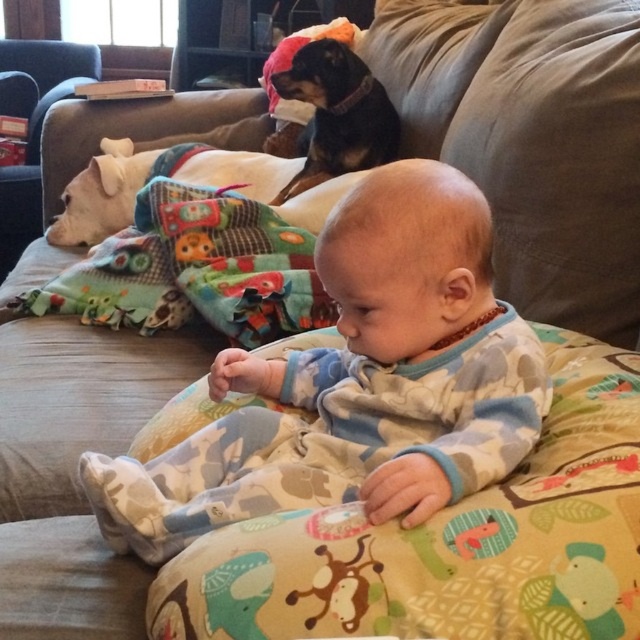
Measure the distance from printed fabric baby at center to white soft dog at left.

7.70 feet

Is printed fabric baby at center thinner than white soft dog at left?

No.

Who is more forward, (321,608) or (19,250)?

Point (321,608)

Locate an element on the screen. printed fabric baby at center is located at coordinates (449, 541).

Does printed fabric baby at center appear over black smooth dog at upper center?

Actually, printed fabric baby at center is below black smooth dog at upper center.

Which is above, printed fabric baby at center or black smooth dog at upper center?

black smooth dog at upper center

Does point (458, 609) lie in front of point (314, 184)?

Yes, it is.

Identify the location of printed fabric baby at center. (449, 541).

Who is lower down, fluffy blue and white pajamas at center or black smooth dog at upper center?

Positioned lower is fluffy blue and white pajamas at center.

Does point (188, 444) come behind point (362, 141)?

That is False.

Locate an element on the screen. This screenshot has width=640, height=640. fluffy blue and white pajamas at center is located at coordinates (356, 384).